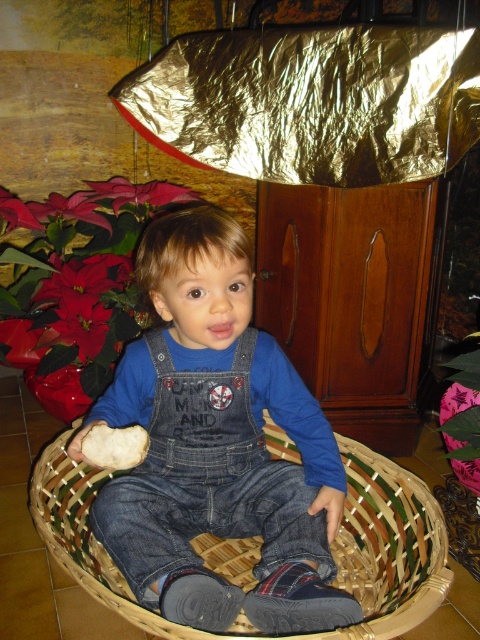
Question: Which point is closer to the camera taking this photo?

Choices:
 (A) (319, 512)
 (B) (63, 522)

Answer: (A)

Question: Among these objects, which one is farthest from the camera?

Choices:
 (A) woven wood basket at center
 (B) denim overalls at center

Answer: (B)

Question: Is denim overalls at center bigger than woven wood basket at center?

Choices:
 (A) no
 (B) yes

Answer: (A)

Question: Is denim overalls at center to the left of woven wood basket at center from the viewer's perspective?

Choices:
 (A) yes
 (B) no

Answer: (A)

Question: In this image, where is denim overalls at center located relative to woven wood basket at center?

Choices:
 (A) above
 (B) below

Answer: (A)